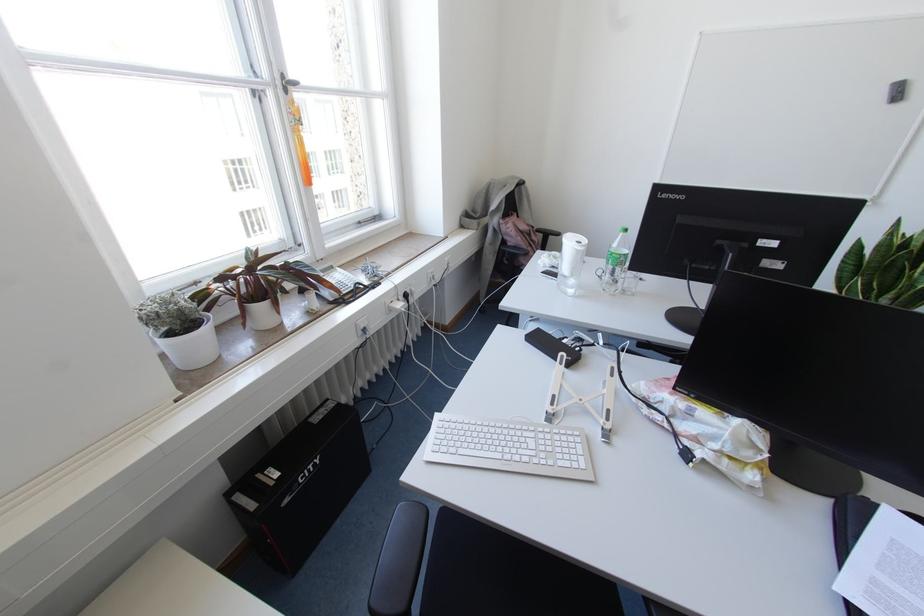
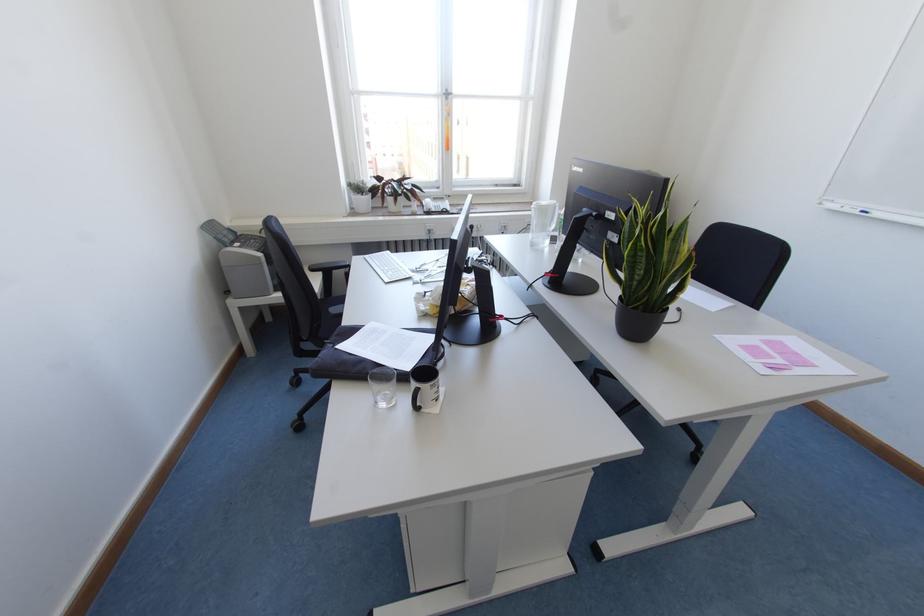
Question: I am providing you with two images of the same scene from different viewpoints. Please identify which objects are invisible in image2.

Choices:
 (A) window handle
 (B) dark grey pot
 (C) chair sitting surface
 (D) metal skimmer

Answer: (C)